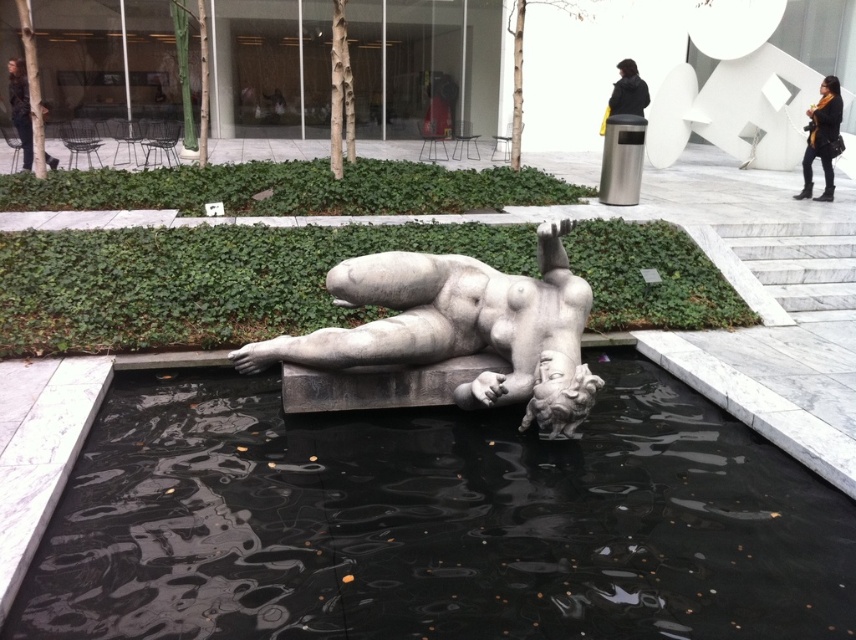
Does black polished water at center lie in front of white marble statue at center?

Yes.

The image size is (856, 640). What do you see at coordinates (434, 522) in the screenshot? I see `black polished water at center` at bounding box center [434, 522].

Is point (236, 483) behind point (461, 324)?

That is False.

Where is `black polished water at center`? black polished water at center is located at coordinates (434, 522).

Which is above, white marble statue at center or yellow scarf at upper right?

yellow scarf at upper right

Who is more distant from viewer, (562, 259) or (813, 108)?

Positioned behind is point (813, 108).

The width and height of the screenshot is (856, 640). I want to click on white marble statue at center, so click(x=461, y=326).

Does black polished water at center have a greater width compared to dark woolen coat at upper center?

Yes.

Describe the element at coordinates (434, 522) in the screenshot. I see `black polished water at center` at that location.

At what (x,y) coordinates should I click in order to perform the action: click on black polished water at center. Please return your answer as a coordinate pair (x, y). The width and height of the screenshot is (856, 640). Looking at the image, I should click on (434, 522).